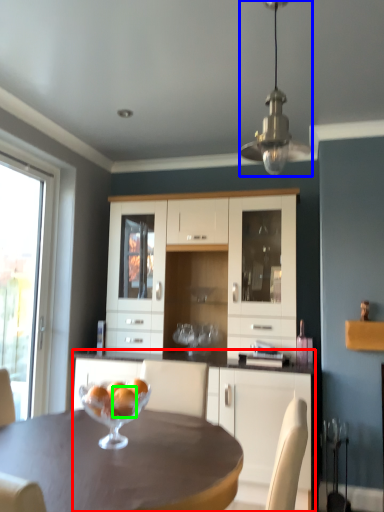
Question: Based on their relative distances, which object is farther from cabinetry (highlighted by a red box)? Choose from lamp (highlighted by a blue box) and orange (highlighted by a green box).

Choices:
 (A) lamp
 (B) orange

Answer: (A)